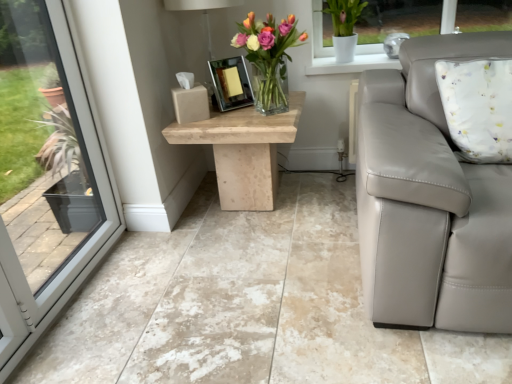
Question: Does point (245, 94) appear closer or farther from the camera than point (249, 52)?

Choices:
 (A) farther
 (B) closer

Answer: (A)

Question: From a real-world perspective, is shiny silver picture frame at center positioned above or below translucent glass vase at center?

Choices:
 (A) above
 (B) below

Answer: (B)

Question: Considering the real-world distances, which object is closest to the natural stone table at center?

Choices:
 (A) translucent glass vase at center
 (B) beige marble floor at center
 (C) matte white lamp at upper center
 (D) shiny silver picture frame at center

Answer: (D)

Question: Based on their relative distances, which object is nearer to the translucent glass vase at center?

Choices:
 (A) beige marble floor at center
 (B) matte white lamp at upper center
 (C) natural stone table at center
 (D) shiny silver picture frame at center

Answer: (D)